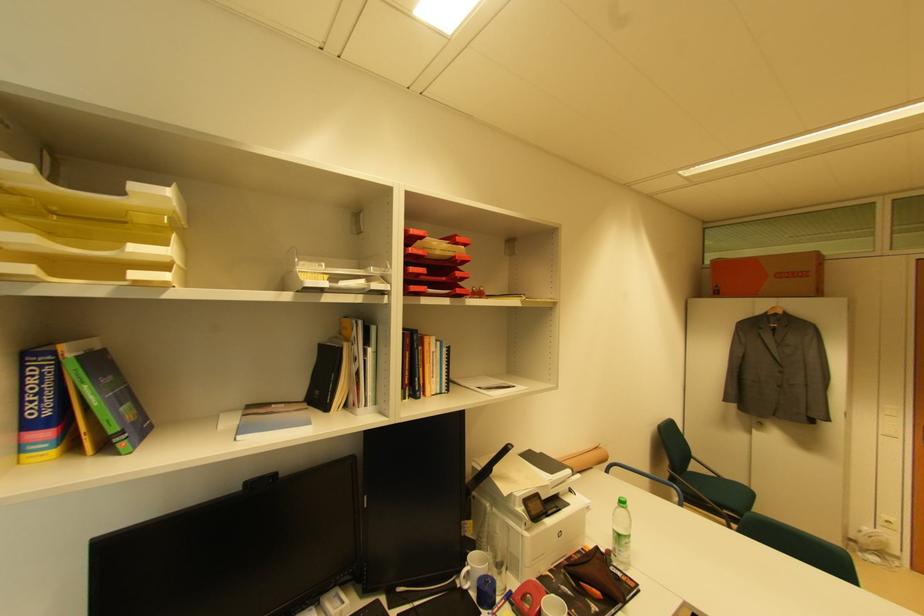
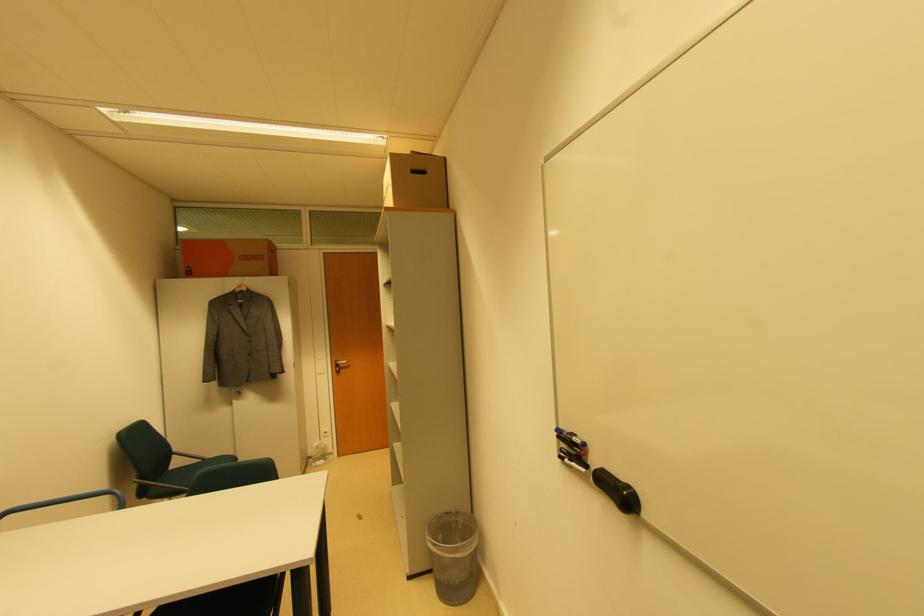
Question: The camera is either moving clockwise (left) or counter-clockwise (right) around the object. The first image is from the beginning of the video and the second image is from the end. Is the camera moving left or right when shooting the video?

Choices:
 (A) Left
 (B) Right

Answer: (A)